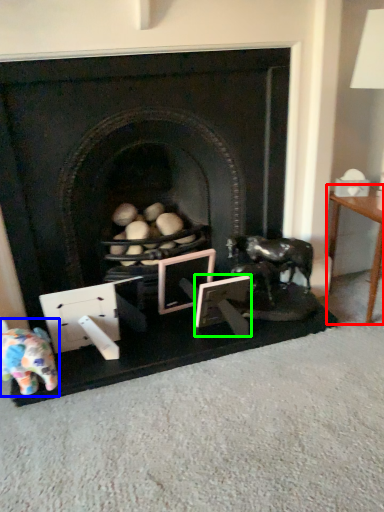
Question: Considering the real-world distances, which object is farthest from table (highlighted by a red box)? toy (highlighted by a blue box) or picture frame (highlighted by a green box)?

Choices:
 (A) toy
 (B) picture frame

Answer: (A)